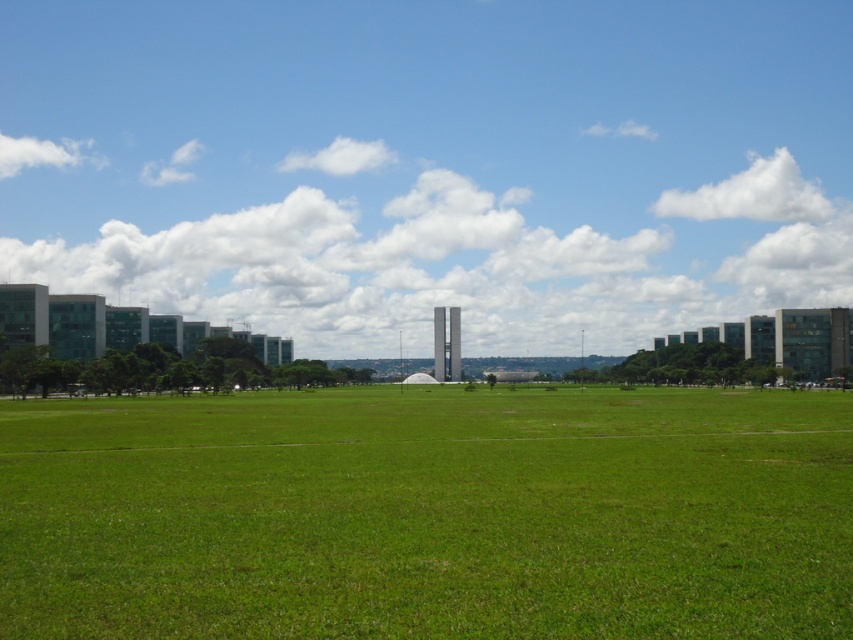
Is transparent glass buildings at center shorter than green grass at center?

No, transparent glass buildings at center is not shorter than green grass at center.

Describe the element at coordinates (431, 164) in the screenshot. The image size is (853, 640). I see `transparent glass buildings at center` at that location.

Find the location of a particular element. transparent glass buildings at center is located at coordinates (431, 164).

Find the location of a particular element. The height and width of the screenshot is (640, 853). transparent glass buildings at center is located at coordinates (431, 164).